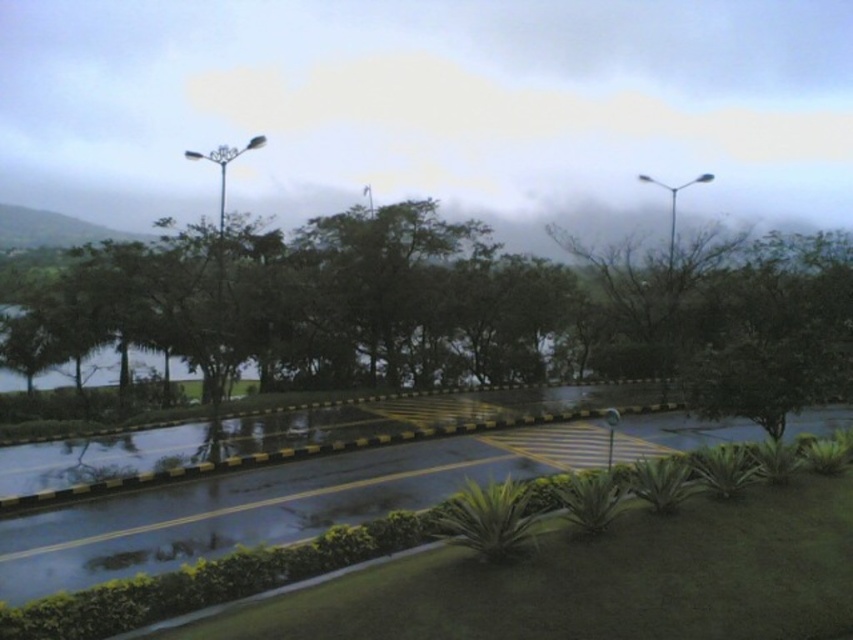
You are a delivery person standing at the green leafy tree at center and need to reach the wet asphalt road at lower center. Can you walk directly to the road without stepping on any obstacles?

The green leafy tree at center is 28.42 feet away from the wet asphalt road at lower center. Since there are no obstacles mentioned between them in the scene description, you can walk directly to the road.

You are a delivery person trying to navigate a narrow path between the green leafy tree at center and the wet asphalt road at lower center. Can you pass through this space without hitting the tree?

The green leafy tree at center is above the wet asphalt road at lower center, so there is vertical clearance for the delivery person to pass underneath without hitting the tree.

You are a delivery robot navigating a wet parking lot. You need to move from your current position to a delivery point located at point [142,548]. There is an obstacle at point [335,230]. Will you encounter the obstacle before reaching the delivery point?

Point [335,230] is behind point [142,548], so the obstacle at point [335,230] will be encountered after reaching the delivery point. Therefore, you will not encounter the obstacle before reaching the delivery point.